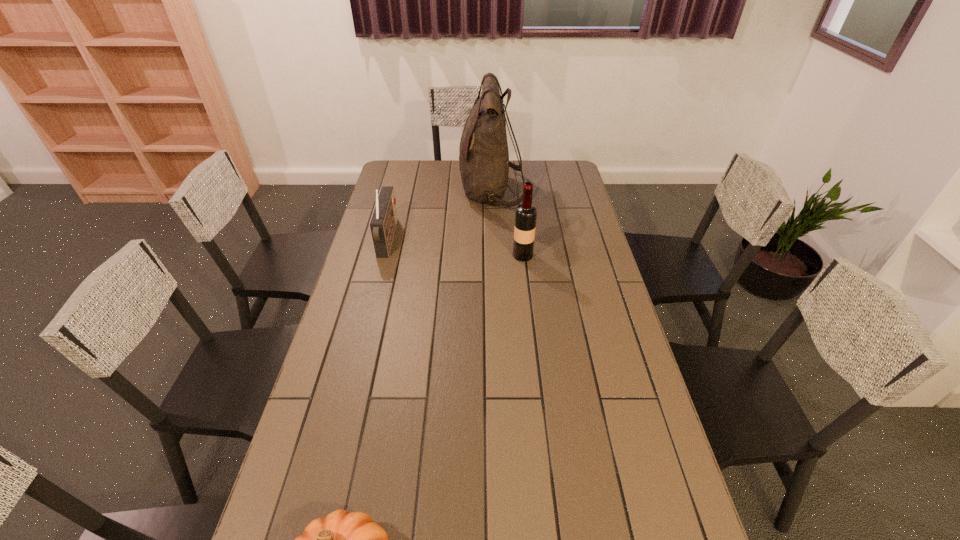
At what (x,y) coordinates should I click in order to perform the action: click on vacant position in the image that satisfies the following two spatial constraints: 1. on the open flap of the third shortest object; 2. on the right side of the farthest object. Please return your answer as a coordinate pair (x, y). The width and height of the screenshot is (960, 540). Looking at the image, I should click on (493, 255).

I want to click on free location that satisfies the following two spatial constraints: 1. on the open flap of the backpack; 2. on the left side of the wine bottle, so click(x=493, y=255).

Where is `free space that satisfies the following two spatial constraints: 1. on the back side of the second tallest object; 2. on the front panel of the third tallest object`? free space that satisfies the following two spatial constraints: 1. on the back side of the second tallest object; 2. on the front panel of the third tallest object is located at coordinates (521, 239).

This screenshot has width=960, height=540. What are the coordinates of `vacant space that satisfies the following two spatial constraints: 1. on the open flap of the second tallest object; 2. on the left side of the farthest object` in the screenshot? It's located at click(x=493, y=255).

Find the location of a particular element. This screenshot has width=960, height=540. free space that satisfies the following two spatial constraints: 1. on the front panel of the radio receiver; 2. on the back side of the third shortest object is located at coordinates (384, 255).